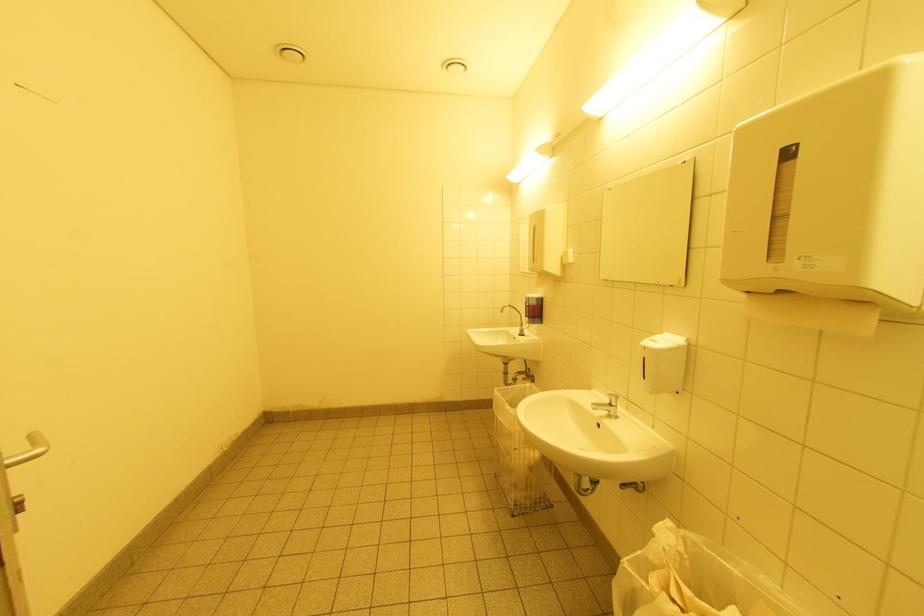
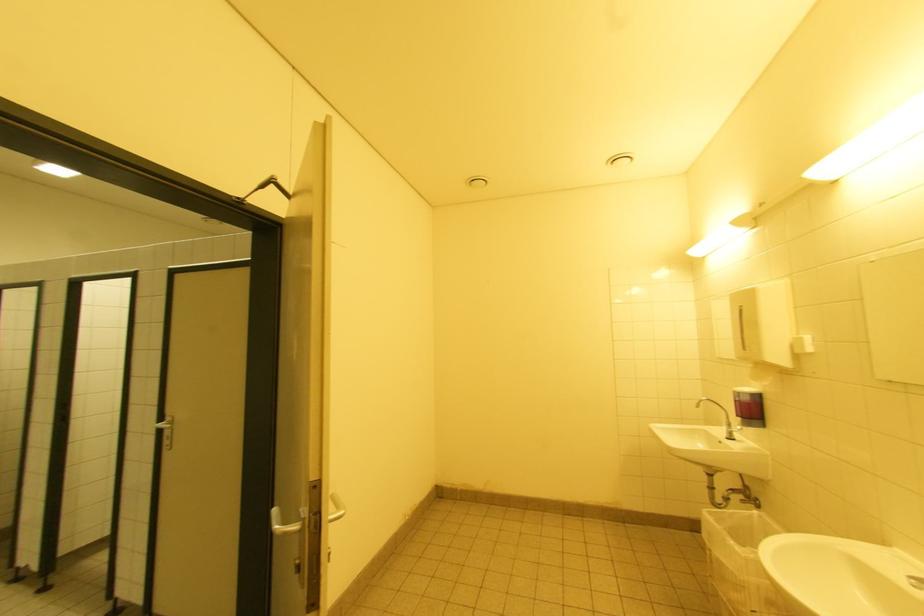
Question: The first image is from the beginning of the video and the second image is from the end. How did the camera likely rotate when shooting the video?

Choices:
 (A) Left
 (B) Right
 (C) Up
 (D) Down

Answer: (A)